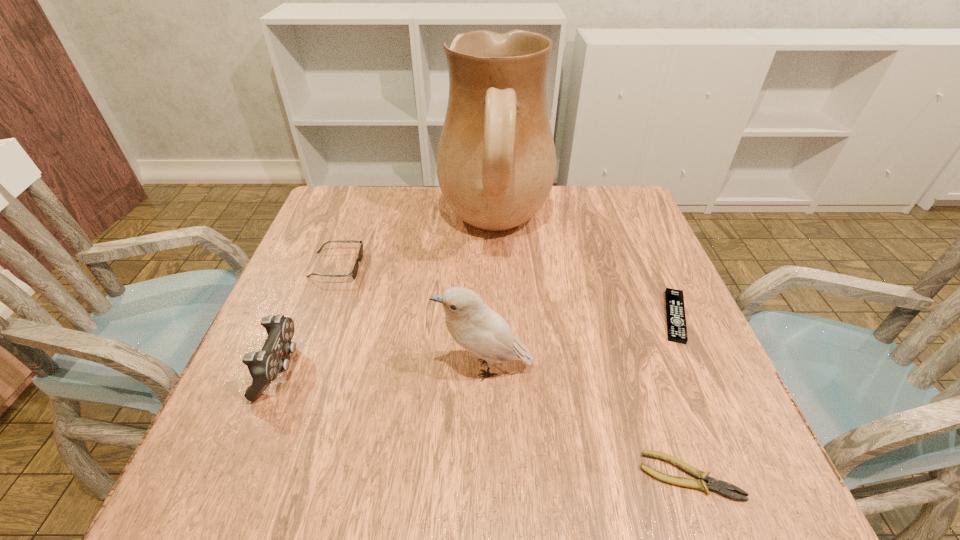
Identify which object is the closest to the tallest object. Please provide its 2D coordinates. Your answer should be formatted as a tuple, i.e. [(x, y)], where the tuple contains the x and y coordinates of a point satisfying the conditions above.

[(360, 254)]

The image size is (960, 540). Find the location of `free location that satisfies the following two spatial constraints: 1. on the back side of the remote control; 2. at the spout of the tallest object`. free location that satisfies the following two spatial constraints: 1. on the back side of the remote control; 2. at the spout of the tallest object is located at coordinates (635, 227).

This screenshot has width=960, height=540. In order to click on vacant point that satisfies the following two spatial constraints: 1. at the beak of the fifth shortest object; 2. on the left side of the nearest object in this screenshot , I will do tap(485, 476).

Where is `vacant position in the image that satisfies the following two spatial constraints: 1. on the front-facing side of the nearest object; 2. on the right side of the fourth tallest object`? vacant position in the image that satisfies the following two spatial constraints: 1. on the front-facing side of the nearest object; 2. on the right side of the fourth tallest object is located at coordinates (x=259, y=476).

Locate an element on the screen. The image size is (960, 540). free spot that satisfies the following two spatial constraints: 1. at the spout of the cream pitcher; 2. on the left side of the nearest object is located at coordinates (506, 476).

Where is `vacant region that satisfies the following two spatial constraints: 1. at the beak of the second tallest object; 2. on the left side of the pliers`? The height and width of the screenshot is (540, 960). vacant region that satisfies the following two spatial constraints: 1. at the beak of the second tallest object; 2. on the left side of the pliers is located at coordinates (485, 476).